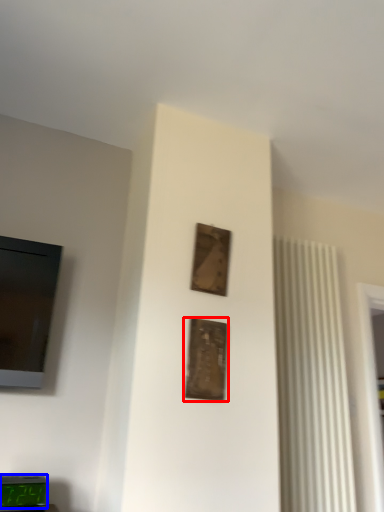
Question: Among these objects, which one is nearest to the camera, picture frame (highlighted by a red box) or alarm clock (highlighted by a blue box)?

Choices:
 (A) picture frame
 (B) alarm clock

Answer: (B)